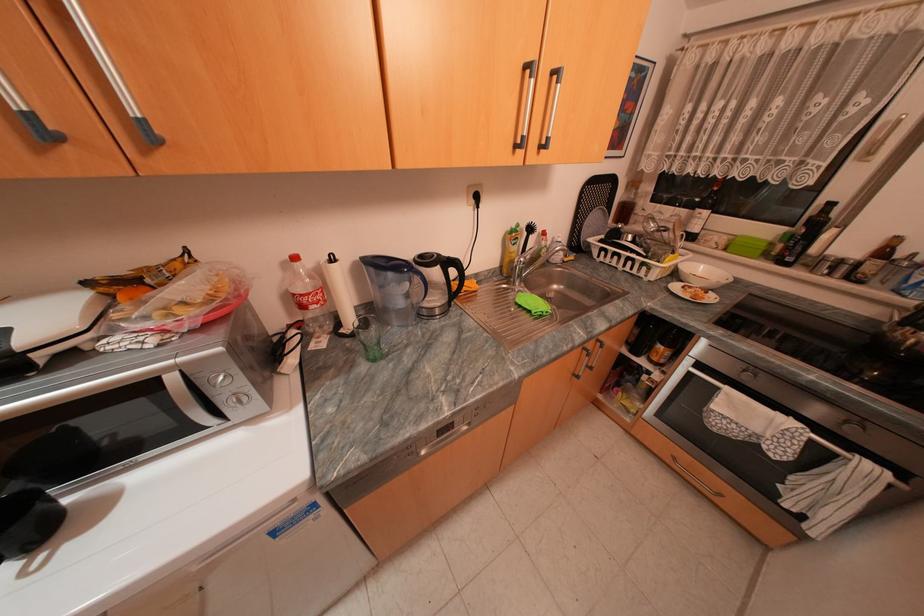
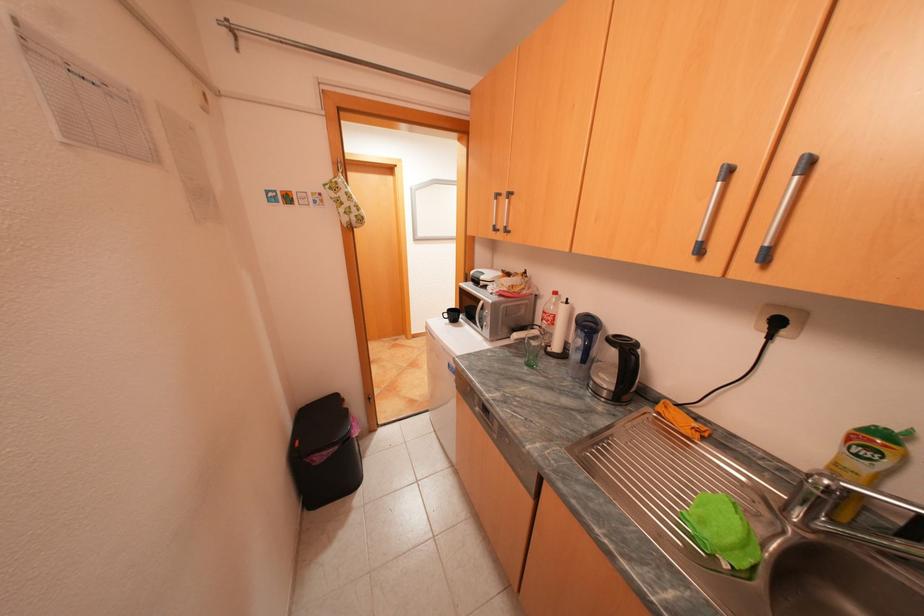
Where in the second image is the point corresponding to the point at 334,286 from the first image?

(565, 315)